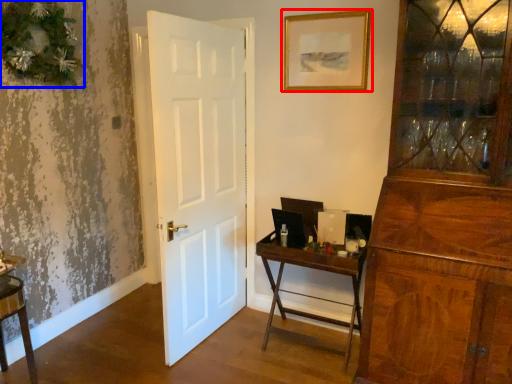
Question: Which point is further to the camera, picture frame (highlighted by a red box) or christmas decoration (highlighted by a blue box)?

Choices:
 (A) picture frame
 (B) christmas decoration

Answer: (A)